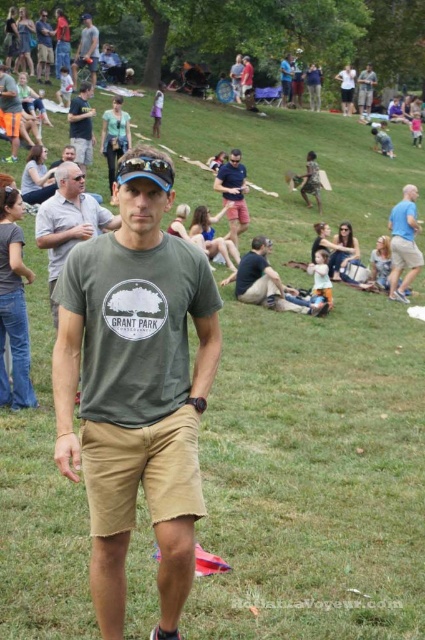
You are taking a photo of the scene and want to ensure both the green cotton shirt at center and the matte gray shirt at upper left are visible. Based on their positions, which shirt is closer to the camera?

The green cotton shirt at center is positioned under the matte gray shirt at upper left, meaning the matte gray shirt at upper left is closer to the camera.